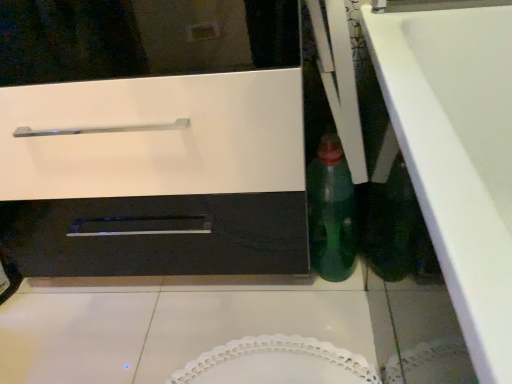
I want to click on free spot in front of green glass bottle at center-right, so click(329, 317).